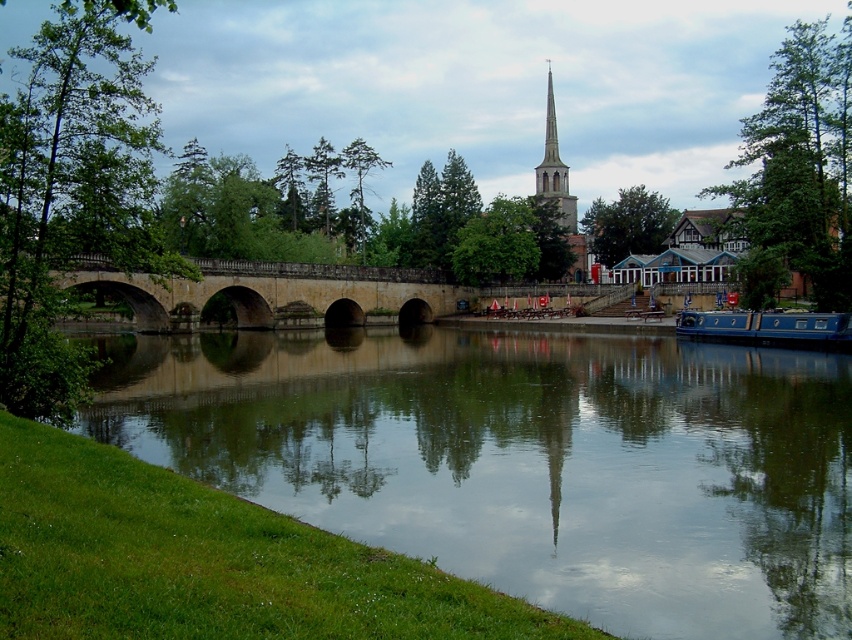
Can you confirm if blue polished wood boat at lower right is positioned to the right of smooth stone spire at upper center?

No, blue polished wood boat at lower right is not to the right of smooth stone spire at upper center.

This screenshot has width=852, height=640. What do you see at coordinates (769, 328) in the screenshot?
I see `blue polished wood boat at lower right` at bounding box center [769, 328].

Where is `blue polished wood boat at lower right`? The height and width of the screenshot is (640, 852). blue polished wood boat at lower right is located at coordinates (769, 328).

Does stone bridge at center have a greater width compared to blue polished wood boat at lower right?

Yes.

Which of these two, stone bridge at center or blue polished wood boat at lower right, stands shorter?

Standing shorter between the two is blue polished wood boat at lower right.

Between point (116, 272) and point (718, 317), which one is positioned behind?

The point (116, 272) is more distant.

Where is `stone bridge at center`? stone bridge at center is located at coordinates pyautogui.click(x=273, y=292).

Is point (383, 384) closer to camera compared to point (550, 134)?

Yes.

Who is more distant from viewer, (x=321, y=470) or (x=561, y=209)?

Positioned behind is point (x=561, y=209).

I want to click on green grassy bank at lower left, so click(x=527, y=460).

This screenshot has height=640, width=852. Find the location of `green grassy bank at lower left`. green grassy bank at lower left is located at coordinates (527, 460).